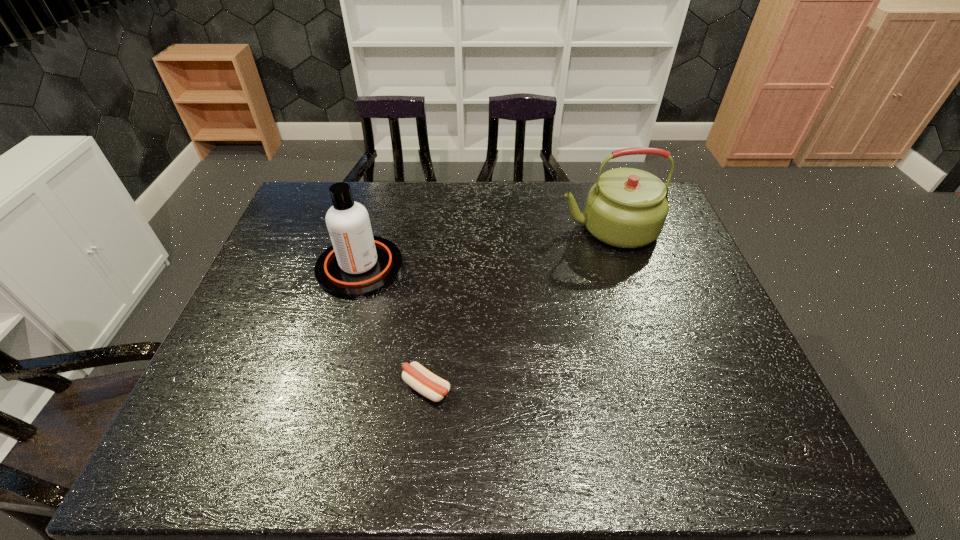
At what (x,y) coordinates should I click in order to perform the action: click on vacant area that lies between the cleansing agent and the sausage. Please return your answer as a coordinate pair (x, y). This screenshot has height=540, width=960. Looking at the image, I should click on (394, 327).

Where is `empty space that is in between the rightmost object and the cleansing agent`? empty space that is in between the rightmost object and the cleansing agent is located at coordinates (484, 247).

At what (x,y) coordinates should I click in order to perform the action: click on empty space between the sausage and the kettle. Please return your answer as a coordinate pair (x, y). The height and width of the screenshot is (540, 960). Looking at the image, I should click on (517, 308).

The height and width of the screenshot is (540, 960). What are the coordinates of `blank region between the second object from left to right and the rightmost object` in the screenshot? It's located at [x=517, y=308].

Identify the location of free space that is in between the rightmost object and the leftmost object. This screenshot has width=960, height=540. (484, 247).

What are the coordinates of `empty location between the rightmost object and the cleansing agent` in the screenshot? It's located at (x=484, y=247).

Locate an element on the screen. The height and width of the screenshot is (540, 960). vacant area that lies between the rightmost object and the second object from right to left is located at coordinates (517, 308).

Image resolution: width=960 pixels, height=540 pixels. I want to click on object that is the second closest to the shortest object, so click(626, 208).

Identify which object is located as the nearest to the shortest object. Please provide its 2D coordinates. Your answer should be formatted as a tuple, i.e. [(x, y)], where the tuple contains the x and y coordinates of a point satisfying the conditions above.

[(357, 264)]

Image resolution: width=960 pixels, height=540 pixels. Identify the location of vacant space that satisfies the following two spatial constraints: 1. on the front side of the cleansing agent; 2. on the right side of the shortest object. tap(326, 388).